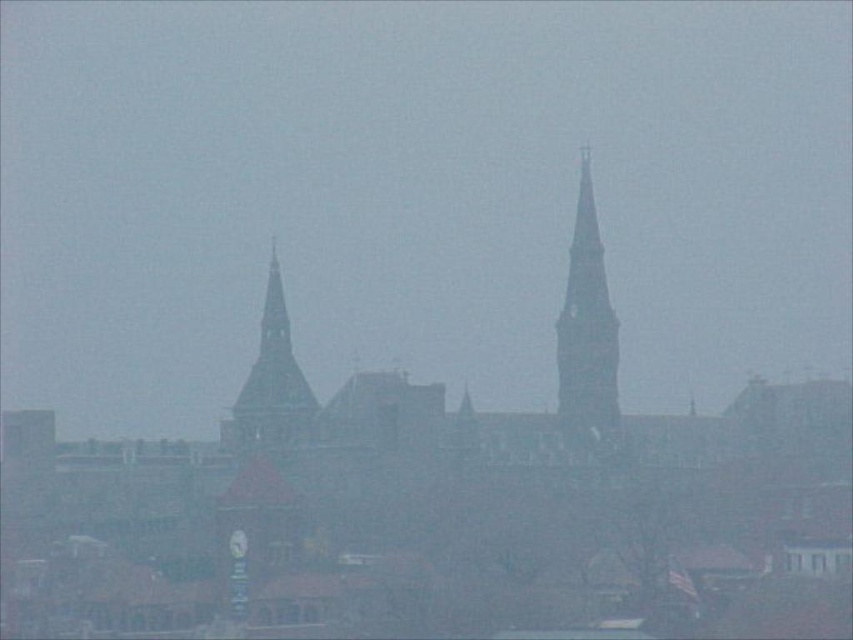
Question: Does smooth gray stone bell tower at center right appear on the right side of smooth stone bell tower at center?

Choices:
 (A) no
 (B) yes

Answer: (B)

Question: Which point is closer to the camera?

Choices:
 (A) smooth gray stone bell tower at center right
 (B) smooth stone bell tower at center

Answer: (B)

Question: Does smooth gray stone bell tower at center right have a smaller size compared to smooth stone bell tower at center?

Choices:
 (A) yes
 (B) no

Answer: (A)

Question: Among these points, which one is farthest from the camera?

Choices:
 (A) (589, 381)
 (B) (267, 413)

Answer: (A)

Question: Where is smooth gray stone bell tower at center right located in relation to smooth stone bell tower at center in the image?

Choices:
 (A) above
 (B) below

Answer: (A)